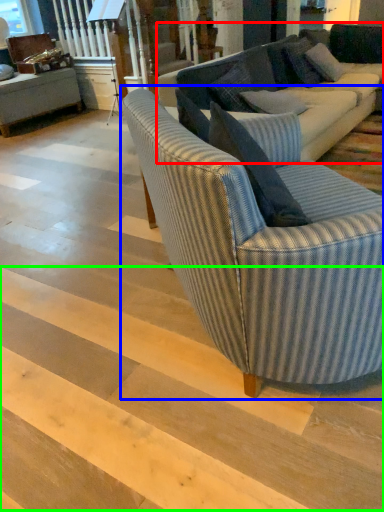
Question: Which is nearer to the studio couch (highlighted by a red box)? studio couch (highlighted by a blue box) or stairwell (highlighted by a green box).

Choices:
 (A) studio couch
 (B) stairwell

Answer: (A)